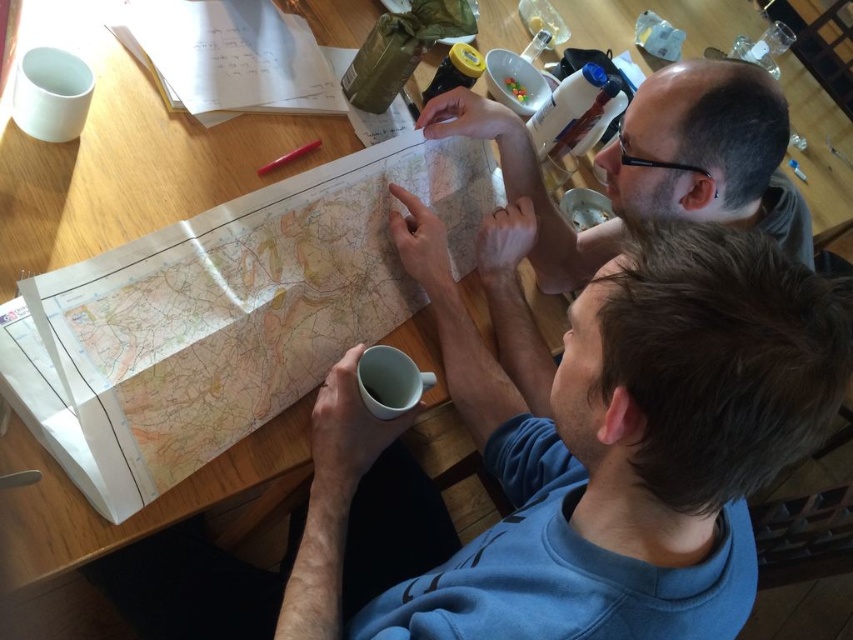
You are trying to place a new decorative item on the table. The item is exactly the same size as the white matte mug at lower center. Can you fit it next to the paper map at center without overlapping?

The paper map at center is wider than the white matte mug at lower center, so there should be enough space to place the new item next to it without overlapping.

You are a person looking at the map and want to find the point at coordinates (708,150). What is the texture of the area at that point?

The point at coordinates (708,150) corresponds to smooth skin at upper right, so the texture there is smooth.

You are standing in front of the table where two people are looking at a map. There are two points on the map labeled as point (814, 292) and point (293, 264). Which point is closer to you?

Point (814, 292) is closer to the camera than point (293, 264), so the point closer to you is point (814, 292).